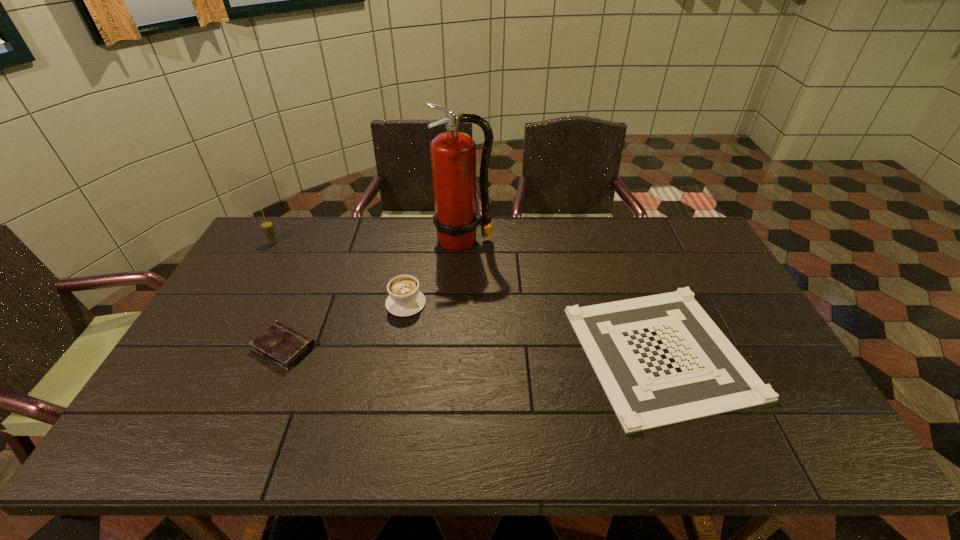
At what (x,y) coordinates should I click in order to perform the action: click on the second object from right to left. Please return your answer as a coordinate pair (x, y). Looking at the image, I should click on (453, 154).

Image resolution: width=960 pixels, height=540 pixels. I want to click on the tallest object, so click(x=453, y=154).

Locate an element on the screen. The height and width of the screenshot is (540, 960). straw for drinking is located at coordinates (267, 226).

This screenshot has width=960, height=540. Find the location of `the second tallest object`. the second tallest object is located at coordinates (267, 226).

Locate an element on the screen. Image resolution: width=960 pixels, height=540 pixels. the third shortest object is located at coordinates (405, 299).

The width and height of the screenshot is (960, 540). What are the coordinates of `the third object from right to left` in the screenshot? It's located at (405, 299).

At what (x,y) coordinates should I click in order to perform the action: click on the second shortest object. Please return your answer as a coordinate pair (x, y). This screenshot has height=540, width=960. Looking at the image, I should click on (281, 344).

Find the location of a particular element. This screenshot has width=960, height=540. the second object from left to right is located at coordinates (281, 344).

This screenshot has height=540, width=960. What are the coordinates of `the rightmost object` in the screenshot? It's located at (660, 359).

Find the location of a particular element. This screenshot has height=540, width=960. the shortest object is located at coordinates coord(660,359).